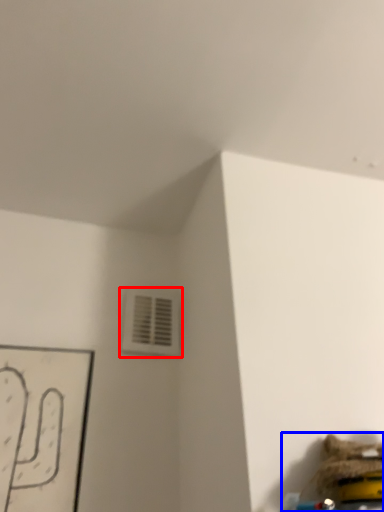
Question: Which object is closer to the camera taking this photo, air conditioning (highlighted by a red box) or toy (highlighted by a blue box)?

Choices:
 (A) air conditioning
 (B) toy

Answer: (B)